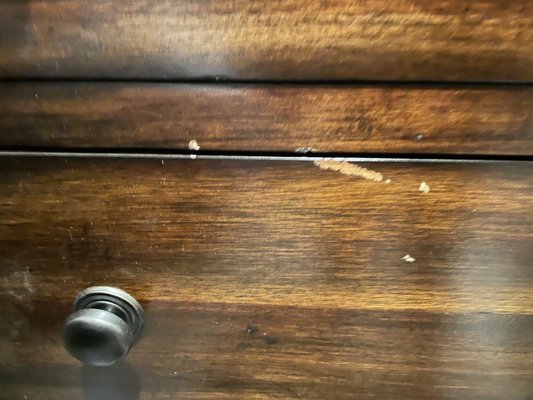
Find the location of a particular element. Image resolution: width=533 pixels, height=400 pixels. wooden door is located at coordinates (263, 237).